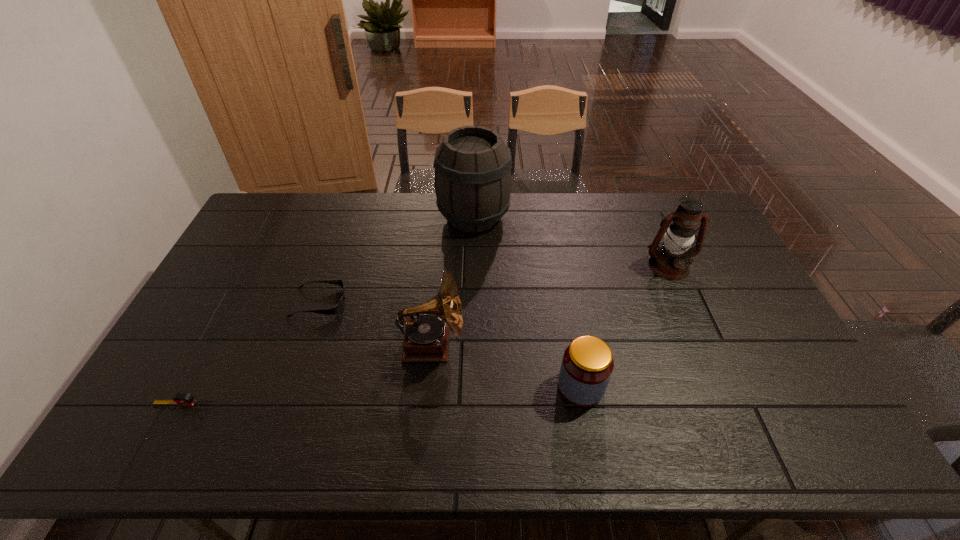
Identify the location of free space at the left edge. (259, 262).

You are a GUI agent. You are given a task and a screenshot of the screen. Output one action in this format:
    pyautogui.click(x=<x>, y=<y>)
    Task: Click on the free location at the right edge of the desktop
    The image size is (960, 540).
    Given the screenshot: What is the action you would take?
    pyautogui.click(x=727, y=320)

Where is `vacant space at the far left corner of the desktop`? vacant space at the far left corner of the desktop is located at coordinates (284, 211).

Identify the location of free space at the near right corner of the desktop. (808, 429).

At what (x,y) coordinates should I click in order to perform the action: click on free area in between the fifth object from left to right and the third tallest object. Please return your answer as a coordinate pair (x, y). The height and width of the screenshot is (540, 960). Looking at the image, I should click on (506, 366).

Locate an element on the screen. free space between the fourth tallest object and the farthest object is located at coordinates (527, 302).

Identify the location of free point between the fourth shortest object and the fifth object from right to left. (375, 323).

You are a GUI agent. You are given a task and a screenshot of the screen. Output one action in this format:
    pyautogui.click(x=<x>, y=<y>)
    Task: Click on the vacant space in between the third shortest object and the fourth shortest object
    Image resolution: width=960 pixels, height=540 pixels.
    Given the screenshot: What is the action you would take?
    pyautogui.click(x=506, y=366)

Locate an element on the screen. The height and width of the screenshot is (540, 960). unoccupied position between the tape measure and the fifth object from left to right is located at coordinates click(383, 395).

Locate an element on the screen. The width and height of the screenshot is (960, 540). empty location between the tape measure and the jar is located at coordinates (383, 395).